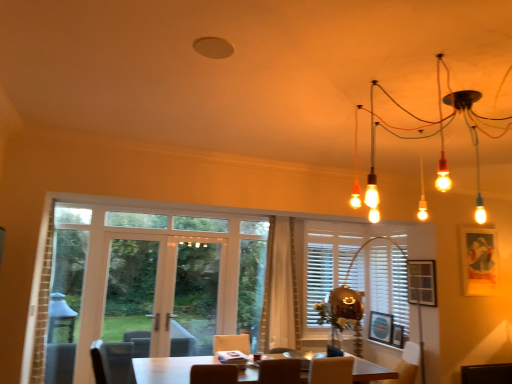
Question: From the image's perspective, is wooden picture frame at right, the 3th picture frame in the left-to-right sequence, located above or below wooden picture frame at center, the fourth picture frame from the right?

Choices:
 (A) below
 (B) above

Answer: (B)

Question: Is wooden picture frame at right, acting as the second picture frame starting from the right, taller or shorter than wooden picture frame at center, the 1th picture frame viewed from the left?

Choices:
 (A) short
 (B) tall

Answer: (B)

Question: Which object is positioned closest to the matte black picture frame at upper right, the first picture frame from the right?

Choices:
 (A) wooden screen door at left, which is counted as the 2th screen door, starting from the right
 (B) white matte blinds at center
 (C) white wooden shutter at left
 (D) matte black chandelier at upper right
 (E) wooden picture frame at right, acting as the second picture frame starting from the right

Answer: (E)

Question: Estimate the real-world distances between objects in this image. Which object is farther from the matte black picture frame at upper right, the first picture frame from the right?

Choices:
 (A) white glass door at center, acting as the 2th screen door starting from the left
 (B) wooden screen door at left, which is counted as the 2th screen door, starting from the right
 (C) orange fabric armchair at lower right
 (D) white wooden shutter at left
 (E) clear glass door at center

Answer: (D)